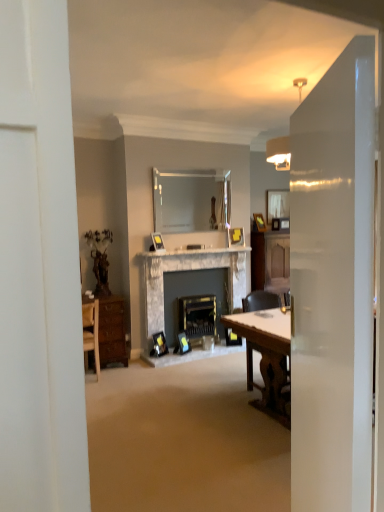
Question: Is transparent glass door at right inside or outside of wooden picture frame at center, which is the 5th picture frame from bottom to top?

Choices:
 (A) outside
 (B) inside

Answer: (A)

Question: From the image's perspective, is transparent glass door at right located above or below wooden picture frame at center, positioned as the 1th picture frame in right-to-left order?

Choices:
 (A) above
 (B) below

Answer: (B)

Question: Estimate the real-world distances between objects in this image. Which object is closer to the wooden chair at right?

Choices:
 (A) clear glass mirror at upper center, which is counted as the second mirror, starting from the right
 (B) wooden picture frame at center, arranged as the 1th picture frame when viewed from the top
 (C) matte yellow picture frame at center, the second picture frame when ordered from top to bottom
 (D) matte glass mirror at upper center, arranged as the second mirror when viewed from the left
 (E) marble fireplace at center, which appears as the second fireplace when viewed from the right

Answer: (E)

Question: Which object is the closest to the transparent glass door at right?

Choices:
 (A) matte glass mirror at upper center, the second mirror in the front-to-back sequence
 (B) wooden picture frame at center, marked as the first picture frame in a back-to-front arrangement
 (C) matte black picture frame at center, marked as the third picture frame in a front-to-back arrangement
 (D) clear glass mirror at upper center, positioned as the 2th mirror in back-to-front order
 (E) marble fireplace at center, which appears as the second fireplace when viewed from the right

Answer: (C)